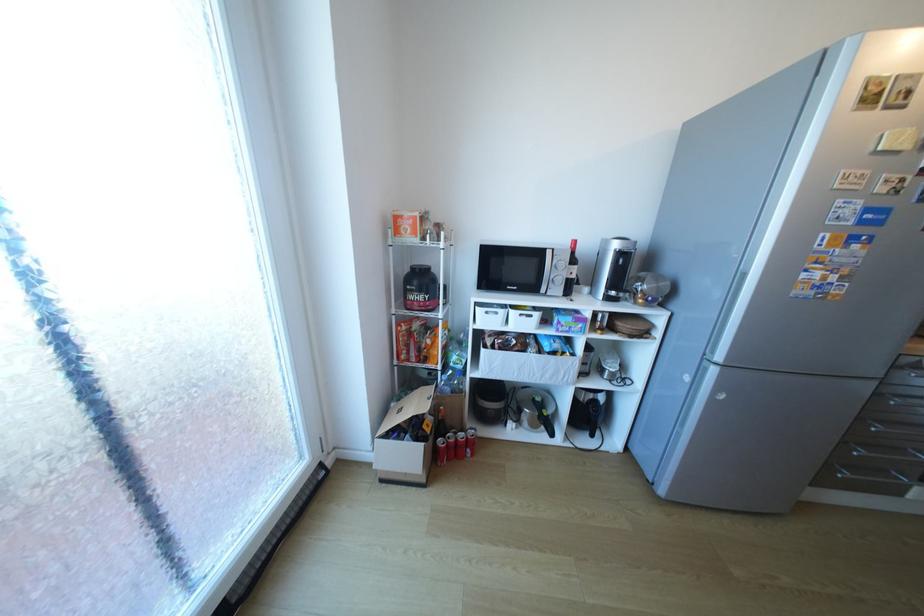
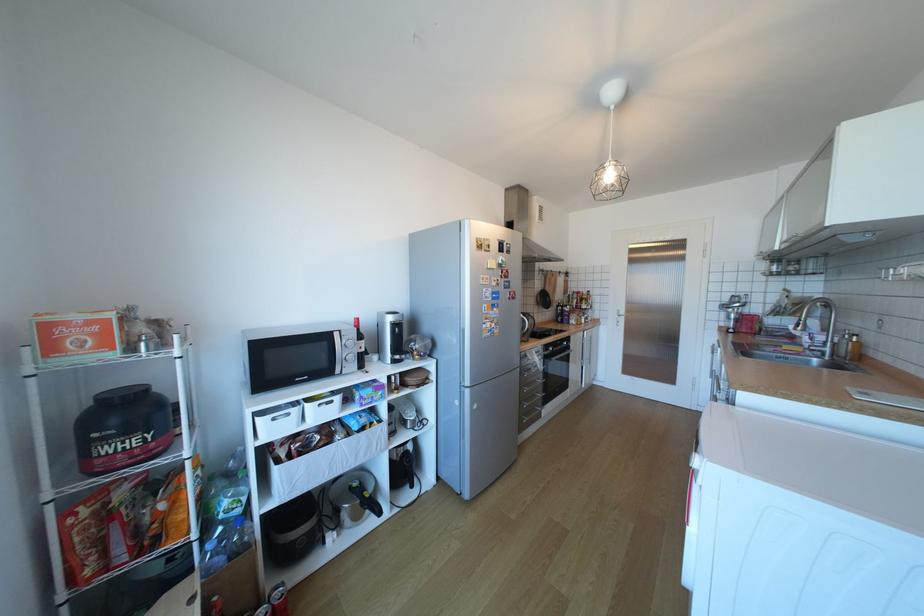
In the second image, find the point that corresponds to the point at 546,414 in the first image.

(369, 501)